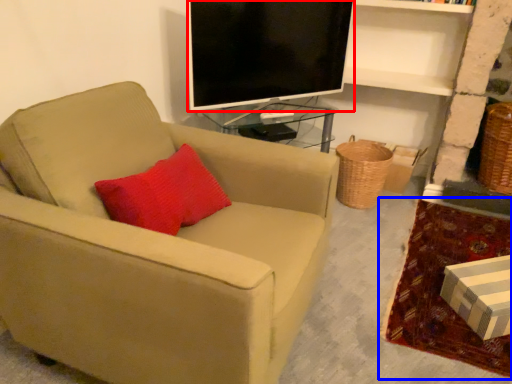
Question: Among these objects, which one is nearest to the camera, television (highlighted by a red box) or plain (highlighted by a blue box)?

Choices:
 (A) television
 (B) plain

Answer: (B)